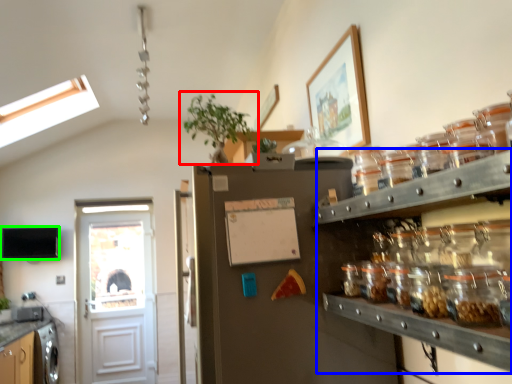
Question: Considering the real-world distances, which object is closest to houseplant (highlighted by a red box)? shelf (highlighted by a blue box) or appliance (highlighted by a green box).

Choices:
 (A) shelf
 (B) appliance

Answer: (A)